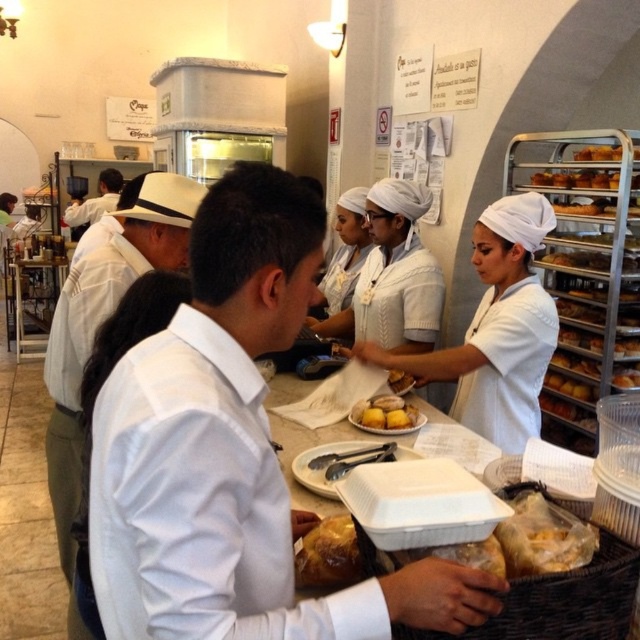
Is woven brown basket at lower center to the right of translucent plastic bag at lower right from the viewer's perspective?

Incorrect, woven brown basket at lower center is not on the right side of translucent plastic bag at lower right.

Is woven brown basket at lower center positioned before translucent plastic bag at lower right?

Yes, woven brown basket at lower center is in front of translucent plastic bag at lower right.

What do you see at coordinates (561, 602) in the screenshot?
I see `woven brown basket at lower center` at bounding box center [561, 602].

Identify the location of woven brown basket at lower center. (561, 602).

Does white uniform shirt at center have a smaller size compared to golden brown bread at center?

Actually, white uniform shirt at center might be larger than golden brown bread at center.

Looking at this image, who is positioned more to the right, white uniform shirt at center or golden brown bread at center?

Positioned to the right is golden brown bread at center.

Who is more distant from viewer, (120, 172) or (616, 369)?

The point (120, 172) is behind.

The height and width of the screenshot is (640, 640). Find the location of `white uniform shirt at center`. white uniform shirt at center is located at coordinates (96, 200).

Between translucent plastic bag at lower right and white cloth at center, which one appears on the left side from the viewer's perspective?

From the viewer's perspective, white cloth at center appears more on the left side.

Measure the distance between translucent plastic bag at lower right and camera.

translucent plastic bag at lower right and camera are 37.39 inches apart from each other.

Identify the location of translucent plastic bag at lower right. (544, 538).